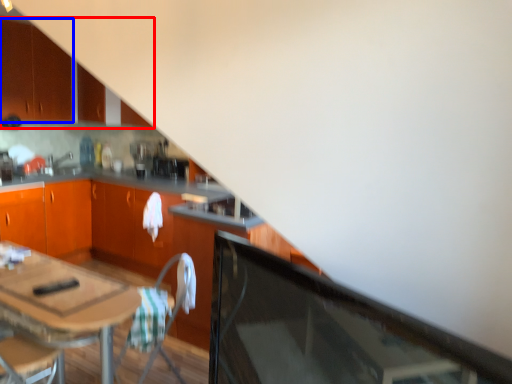
Question: Which point is closer to the camera, cabinetry (highlighted by a red box) or cabinetry (highlighted by a blue box)?

Choices:
 (A) cabinetry
 (B) cabinetry

Answer: (A)